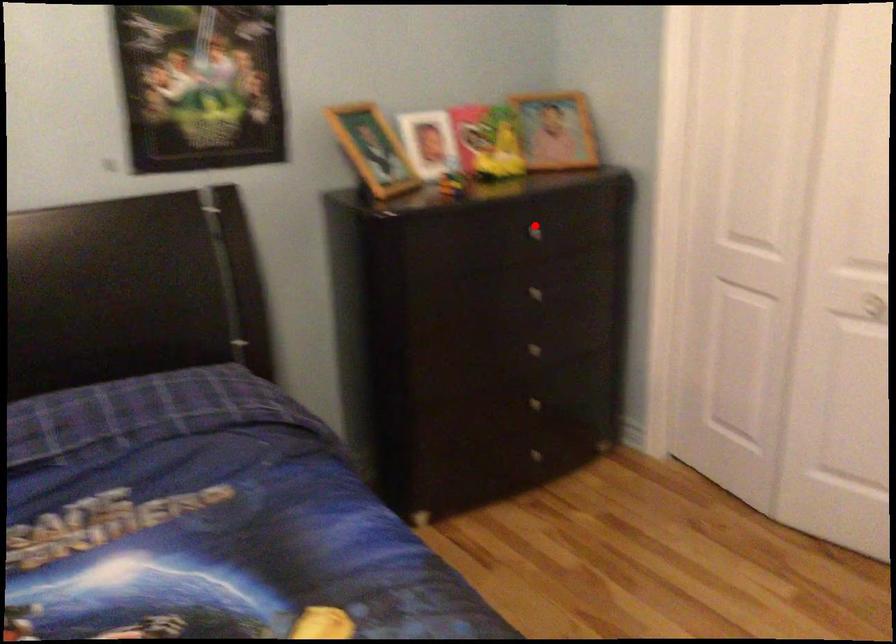
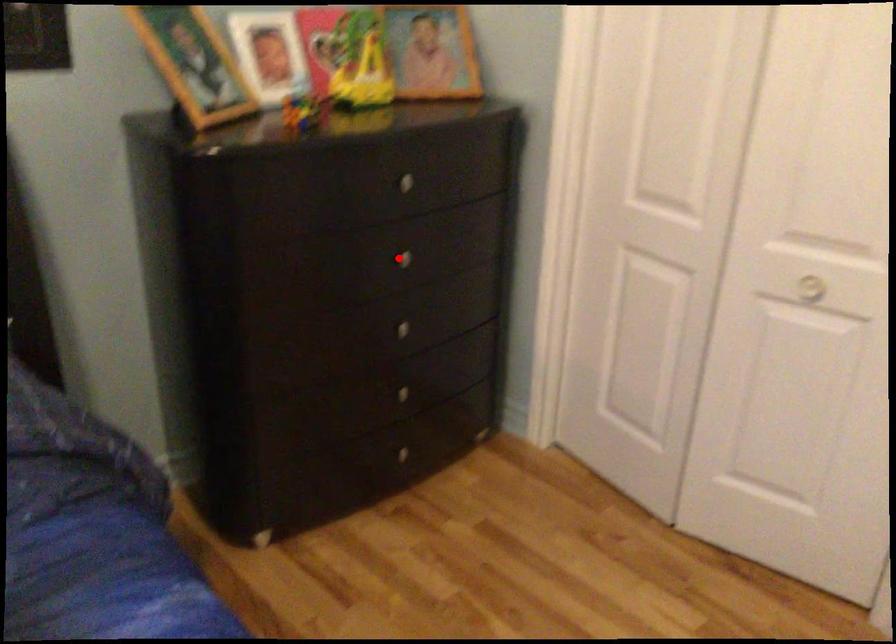
I am providing you with two images of the same scene from different viewpoints. A red point is marked on the first image and another point is marked on the second image. Is the red point in image1 aligned with the point shown in image2?

No